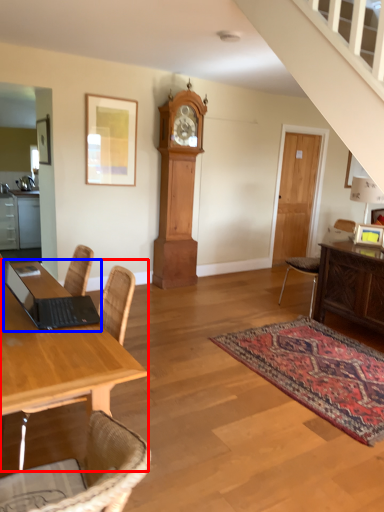
Question: Which object appears closest to the camera in this image, desk (highlighted by a red box) or laptop (highlighted by a blue box)?

Choices:
 (A) desk
 (B) laptop

Answer: (A)